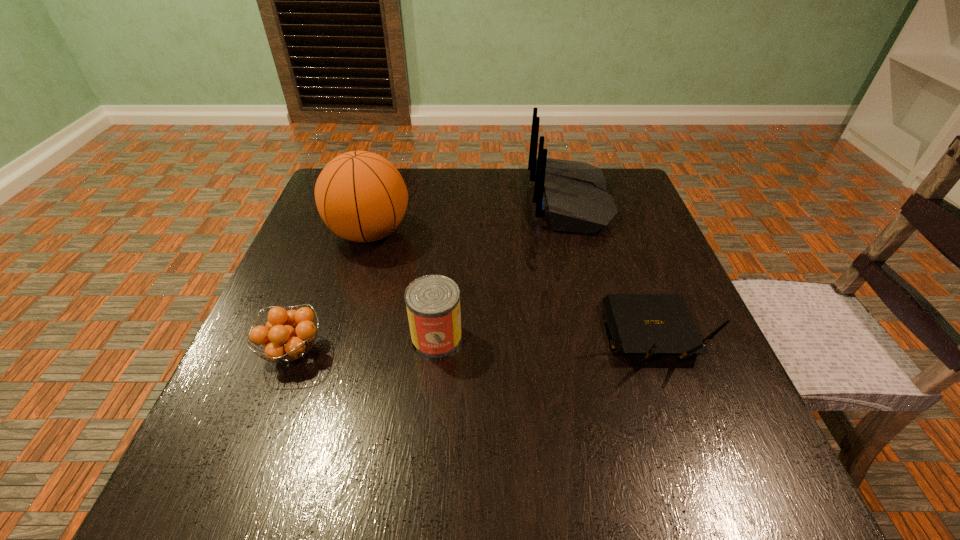
Where is `vacant area that satisfies the following two spatial constraints: 1. on the back of the farther router; 2. on the front side of the orange fruit`? vacant area that satisfies the following two spatial constraints: 1. on the back of the farther router; 2. on the front side of the orange fruit is located at coordinates (610, 351).